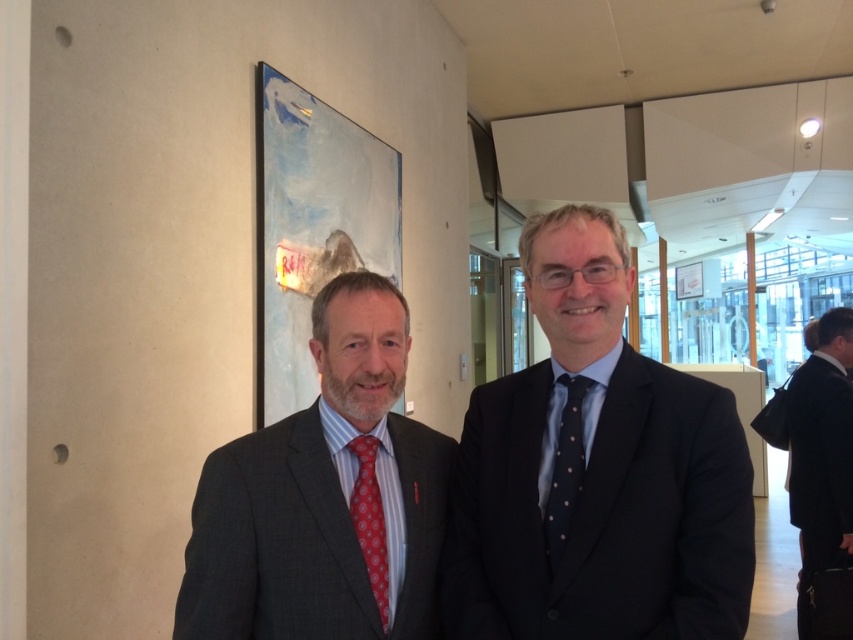
Is black suit at right positioned at the back of blue dotted fabric tie at center?

That is True.

Is black suit at right to the right of blue dotted fabric tie at center from the viewer's perspective?

Yes, black suit at right is to the right of blue dotted fabric tie at center.

In order to click on black suit at right in this screenshot , I will do pos(821,456).

Does blue dotted fabric tie at center come in front of red dotted fabric tie at left?

Yes, blue dotted fabric tie at center is closer to the viewer.

Image resolution: width=853 pixels, height=640 pixels. What do you see at coordinates (566, 467) in the screenshot?
I see `blue dotted fabric tie at center` at bounding box center [566, 467].

The height and width of the screenshot is (640, 853). I want to click on blue dotted fabric tie at center, so click(x=566, y=467).

Is point (485, 545) more distant than point (364, 486)?

Yes, it is behind point (364, 486).

Based on the photo, is dark blue textured suit at center wider than red dotted fabric tie at left?

Correct, the width of dark blue textured suit at center exceeds that of red dotted fabric tie at left.

Who is more forward, (457, 454) or (366, 449)?

Point (366, 449) is in front.

Locate an element on the screen. This screenshot has height=640, width=853. dark blue textured suit at center is located at coordinates (595, 472).